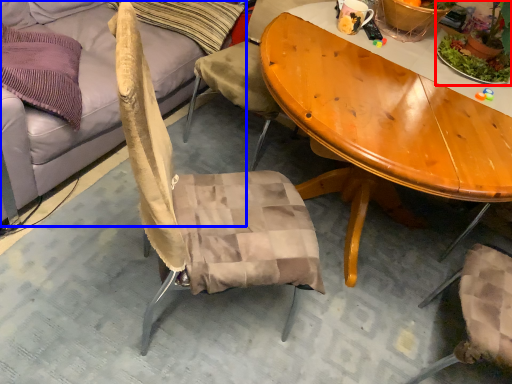
Question: Which of the following is the closest to the observer, houseplant (highlighted by a red box) or studio couch (highlighted by a blue box)?

Choices:
 (A) houseplant
 (B) studio couch

Answer: (B)